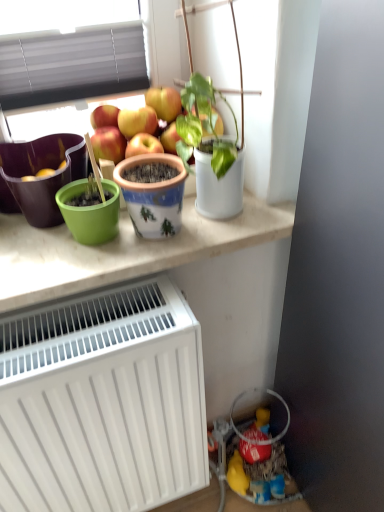
I want to click on green plastic pot at upper center, so click(122, 251).

At what (x,y) coordinates should I click in order to perform the action: click on white matte radiator at lower left. Please return your answer as a coordinate pair (x, y). Image resolution: width=384 pixels, height=512 pixels. Looking at the image, I should click on (103, 402).

Locate an element on the screen. white glossy pot at upper center is located at coordinates (221, 167).

What do you see at coordinates (35, 173) in the screenshot? This screenshot has width=384, height=512. I see `green matte flowerpot at left, which is the 2th flowerpot in right-to-left order` at bounding box center [35, 173].

What are the coordinates of `green plastic pot at upper center` in the screenshot? It's located at (122, 251).

Consider the image. From a real-world perspective, between green matte flowerpot at left, the first flowerpot positioned from the left, and green plastic pot at upper center, who is vertically higher?

green matte flowerpot at left, the first flowerpot positioned from the left, is physically above.

Between green matte flowerpot at left, the first flowerpot positioned from the left, and green plastic pot at upper center, which one appears on the left side from the viewer's perspective?

Positioned to the left is green matte flowerpot at left, the first flowerpot positioned from the left.

Considering the positions of objects green plastic pot at upper center and white glossy pot at upper center in the image provided, who is more to the right, green plastic pot at upper center or white glossy pot at upper center?

Positioned to the right is white glossy pot at upper center.

Are green plastic pot at upper center and white glossy pot at upper center making contact?

No, green plastic pot at upper center is not in contact with white glossy pot at upper center.

From the image's perspective, relative to white glossy pot at upper center, is green plastic pot at upper center above or below?

From the image's perspective, green plastic pot at upper center appears below white glossy pot at upper center.

Relative to white glossy pot at upper center, is green plastic pot at upper center in front or behind?

In the image, green plastic pot at upper center appears behind white glossy pot at upper center.

Consider the image. From a real-world perspective, which object stands above the other?

painted ceramic pot at center, which ranks as the 1th flowerpot in right-to-left order.

Can you confirm if white matte radiator at lower left is thinner than painted ceramic pot at center, the 2th flowerpot when ordered from left to right?

In fact, white matte radiator at lower left might be wider than painted ceramic pot at center, the 2th flowerpot when ordered from left to right.

Which point is more forward, (x=33, y=329) or (x=142, y=231)?

The point (x=33, y=329) is more forward.

Based on the photo, from the image's perspective, which one is positioned lower, white matte radiator at lower left or painted ceramic pot at center, the 2th flowerpot when ordered from left to right?

white matte radiator at lower left.

There is a white matte radiator at lower left. Where is `the 1st flowerpot above it (from a real-world perspective)`? The image size is (384, 512). the 1st flowerpot above it (from a real-world perspective) is located at coordinates (35, 173).

From the image's perspective, is green matte flowerpot at left, the first flowerpot positioned from the left, located above or below white matte radiator at lower left?

Clearly, from the image's perspective, green matte flowerpot at left, the first flowerpot positioned from the left, is above white matte radiator at lower left.

Is green matte flowerpot at left, the first flowerpot positioned from the left, behind white matte radiator at lower left?

Yes, the depth of green matte flowerpot at left, the first flowerpot positioned from the left, is greater than that of white matte radiator at lower left.

Which object is positioned more to the left, green matte flowerpot at left, the first flowerpot positioned from the left, or white matte radiator at lower left?

green matte flowerpot at left, the first flowerpot positioned from the left.

Is green plastic pot at upper center bigger than green matte flowerpot at left, which is the 2th flowerpot in right-to-left order?

Yes.

Is green plastic pot at upper center facing away from green matte flowerpot at left, the first flowerpot positioned from the left?

No, green plastic pot at upper center is not facing away from green matte flowerpot at left, the first flowerpot positioned from the left.

Is green plastic pot at upper center wider or thinner than green matte flowerpot at left, which is the 2th flowerpot in right-to-left order?

In the image, green plastic pot at upper center appears to be wider than green matte flowerpot at left, which is the 2th flowerpot in right-to-left order.

Is green plastic pot at upper center in front of green matte flowerpot at left, which is the 2th flowerpot in right-to-left order?

Yes, green plastic pot at upper center is closer to the camera.

Are painted ceramic pot at center, the 2th flowerpot when ordered from left to right, and white matte radiator at lower left making contact?

No.

Who is smaller, painted ceramic pot at center, the 2th flowerpot when ordered from left to right, or white matte radiator at lower left?

Smaller between the two is painted ceramic pot at center, the 2th flowerpot when ordered from left to right.

Is white matte radiator at lower left at the back of painted ceramic pot at center, which ranks as the 1th flowerpot in right-to-left order?

painted ceramic pot at center, which ranks as the 1th flowerpot in right-to-left order, does not have its back to white matte radiator at lower left.

What's the angular difference between painted ceramic pot at center, which ranks as the 1th flowerpot in right-to-left order, and white matte radiator at lower left's facing directions?

painted ceramic pot at center, which ranks as the 1th flowerpot in right-to-left order, and white matte radiator at lower left are facing 1.32 degrees away from each other.

Is the position of green matte flowerpot at left, which is the 2th flowerpot in right-to-left order, more distant than that of white glossy pot at upper center?

That is True.

Is point (7, 204) positioned after point (221, 214)?

That is True.

Choose the correct answer: Is green matte flowerpot at left, the first flowerpot positioned from the left, inside white glossy pot at upper center or outside it?

green matte flowerpot at left, the first flowerpot positioned from the left, is outside white glossy pot at upper center.

Which of these two, green matte flowerpot at left, the first flowerpot positioned from the left, or white glossy pot at upper center, is wider?

Wider between the two is green matte flowerpot at left, the first flowerpot positioned from the left.

Starting from the green plastic pot at upper center, which flowerpot is the 2nd one behind? Please provide its 2D coordinates.

[(35, 173)]

Where is `table on the left of white glossy pot at upper center`? table on the left of white glossy pot at upper center is located at coordinates (122, 251).

Looking at the image, which one is located further to white glossy pot at upper center, painted ceramic pot at center, which ranks as the 1th flowerpot in right-to-left order, or green plastic pot at upper center?

green plastic pot at upper center is further to white glossy pot at upper center.

Looking at the image, which one is located closer to white matte radiator at lower left, white glossy pot at upper center or green plastic pot at upper center?

Among the two, green plastic pot at upper center is located nearer to white matte radiator at lower left.

Based on their spatial positions, is green plastic pot at upper center or white matte radiator at lower left further from painted ceramic pot at center, the 2th flowerpot when ordered from left to right?

white matte radiator at lower left is positioned further to the anchor painted ceramic pot at center, the 2th flowerpot when ordered from left to right.

Considering their positions, is green plastic pot at upper center positioned closer to green matte flowerpot at left, the first flowerpot positioned from the left, than painted ceramic pot at center, the 2th flowerpot when ordered from left to right?

Based on the image, green plastic pot at upper center appears to be nearer to green matte flowerpot at left, the first flowerpot positioned from the left.

Looking at this image, which object lies nearer to the anchor point white glossy pot at upper center, green plastic pot at upper center or painted ceramic pot at center, which ranks as the 1th flowerpot in right-to-left order?

painted ceramic pot at center, which ranks as the 1th flowerpot in right-to-left order, is closer to white glossy pot at upper center.

Estimate the real-world distances between objects in this image. Which object is closer to painted ceramic pot at center, the 2th flowerpot when ordered from left to right, white glossy pot at upper center or white matte radiator at lower left?

Among the two, white glossy pot at upper center is located nearer to painted ceramic pot at center, the 2th flowerpot when ordered from left to right.

From the image, which object appears to be farther from green matte flowerpot at left, which is the 2th flowerpot in right-to-left order, white matte radiator at lower left or painted ceramic pot at center, the 2th flowerpot when ordered from left to right?

Among the two, white matte radiator at lower left is located further to green matte flowerpot at left, which is the 2th flowerpot in right-to-left order.

When comparing their distances from green matte flowerpot at left, which is the 2th flowerpot in right-to-left order, does painted ceramic pot at center, the 2th flowerpot when ordered from left to right, or white matte radiator at lower left seem further?

The object further to green matte flowerpot at left, which is the 2th flowerpot in right-to-left order, is white matte radiator at lower left.

You are a GUI agent. You are given a task and a screenshot of the screen. Output one action in this format:
    pyautogui.click(x=<x>, y=<y>)
    Task: Click on the table that lies between painted ceramic pot at center, which ranks as the 1th flowerpot in right-to-left order, and white matte radiator at lower left from top to bottom
    
    Given the screenshot: What is the action you would take?
    pyautogui.click(x=122, y=251)

At what (x,y) coordinates should I click in order to perform the action: click on table situated between green matte flowerpot at left, the first flowerpot positioned from the left, and white glossy pot at upper center from left to right. Please return your answer as a coordinate pair (x, y). This screenshot has width=384, height=512. Looking at the image, I should click on (122, 251).

This screenshot has height=512, width=384. I want to click on table between green matte flowerpot at left, which is the 2th flowerpot in right-to-left order, and painted ceramic pot at center, the 2th flowerpot when ordered from left to right, so click(x=122, y=251).

Where is `table between green matte flowerpot at left, the first flowerpot positioned from the left, and white matte radiator at lower left, in the vertical direction`? table between green matte flowerpot at left, the first flowerpot positioned from the left, and white matte radiator at lower left, in the vertical direction is located at coordinates (122, 251).